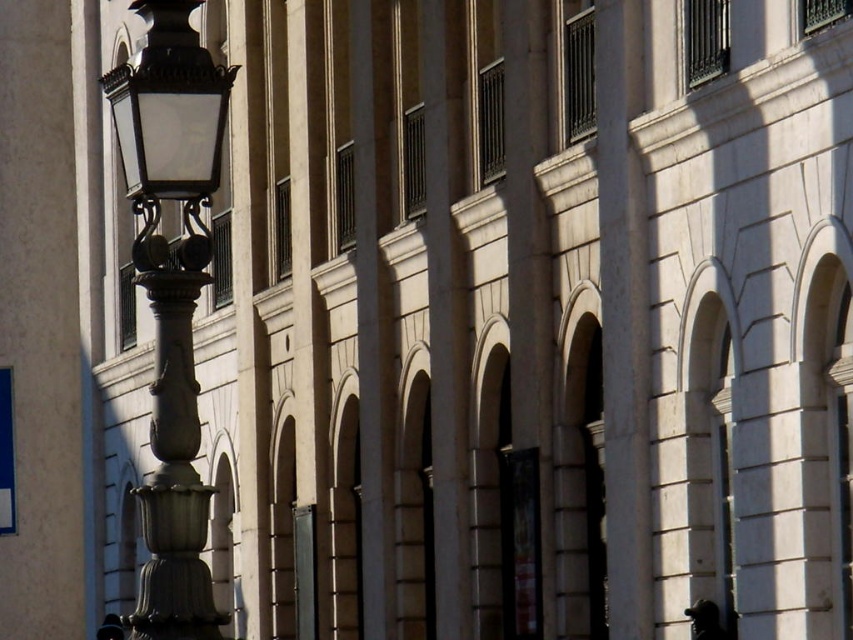
You are standing in front of the classical building and notice two items in the foreground. One is a black glossy statue at lower right and the other is a smooth black hat at lower left. From your perspective, which item is positioned more to the east?

The black glossy statue at lower right is positioned more to the east because it is to the right of the smooth black hat at lower left, and right typically corresponds to east in such symmetrical facades.

You are standing at the entrance of the classical building and want to place a new bench exactly halfway between the entrance and the polished brass streetlight at left. What are the coordinates where you should place the bench?

The polished brass streetlight at left is located at coordinates point (171, 296). To place the bench halfway between the entrance and the streetlight, you would calculate the midpoint between the entrance coordinates and (171, 296). However, since the entrance coordinates are not provided, the exact midpoint cannot be determined without additional information.

Please look at the image and locate the point at coordinates (x=706, y=620). Based on the scene description, which object does this point belong to?

The point at coordinates (x=706, y=620) is on the black glossy statue at lower right.